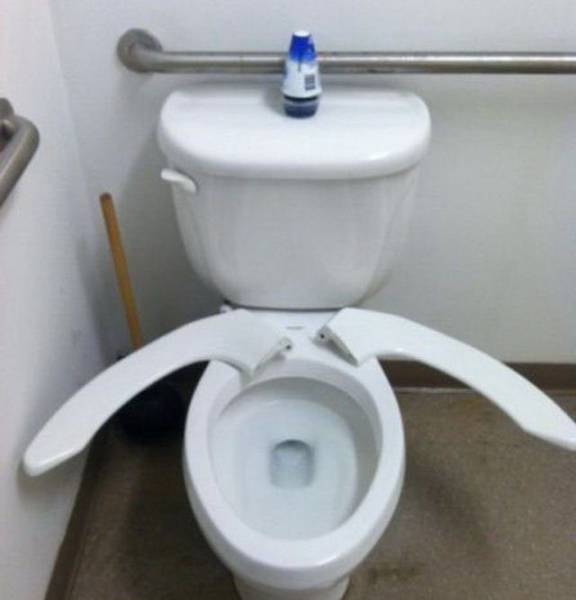
At what (x,y) coordinates should I click in order to perform the action: click on left toilet seat half. Please return your answer as a coordinate pair (x, y). The width and height of the screenshot is (576, 600). Looking at the image, I should click on (102, 403).